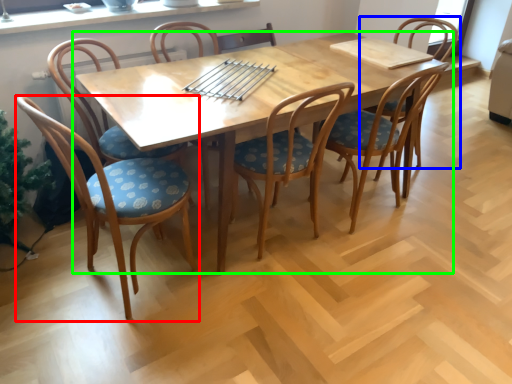
Question: Based on their relative distances, which object is farther from chair (highlighted by a red box)? Choose from chair (highlighted by a blue box) and kitchen & dining room table (highlighted by a green box).

Choices:
 (A) chair
 (B) kitchen & dining room table

Answer: (A)